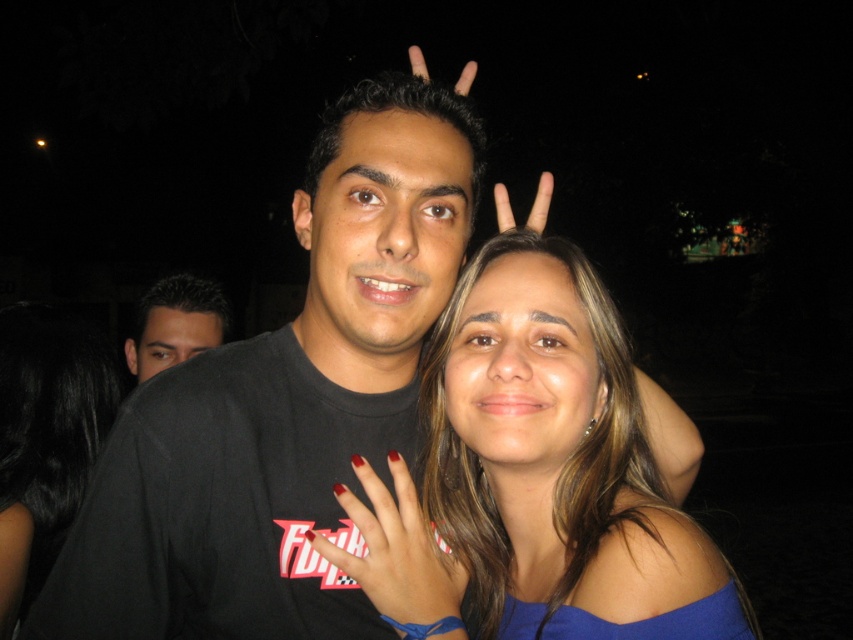
Which is more to the right, black matte shirt at left or matte black hand at upper center?

matte black hand at upper center is more to the right.

Who is shorter, black matte shirt at left or matte black hand at upper center?

black matte shirt at left is shorter.

You are a GUI agent. You are given a task and a screenshot of the screen. Output one action in this format:
    pyautogui.click(x=<x>, y=<y>)
    Task: Click on the black matte shirt at left
    The width and height of the screenshot is (853, 640).
    Given the screenshot: What is the action you would take?
    pyautogui.click(x=175, y=323)

Consider the image. Can you confirm if smooth blue top at center is shorter than black matte shirt at left?

Incorrect, smooth blue top at center's height does not fall short of black matte shirt at left's.

Is point (596, 380) positioned in front of point (194, 282)?

That is True.

Does point (544, 460) come in front of point (154, 369)?

Yes, it is.

This screenshot has width=853, height=640. Identify the location of smooth blue top at center. (538, 474).

Is smooth blue top at center further to the viewer compared to nail polish at center?

No.

Is smooth blue top at center closer to the viewer compared to nail polish at center?

Yes, it is.

The width and height of the screenshot is (853, 640). I want to click on smooth blue top at center, so click(x=538, y=474).

This screenshot has height=640, width=853. I want to click on smooth blue top at center, so click(x=538, y=474).